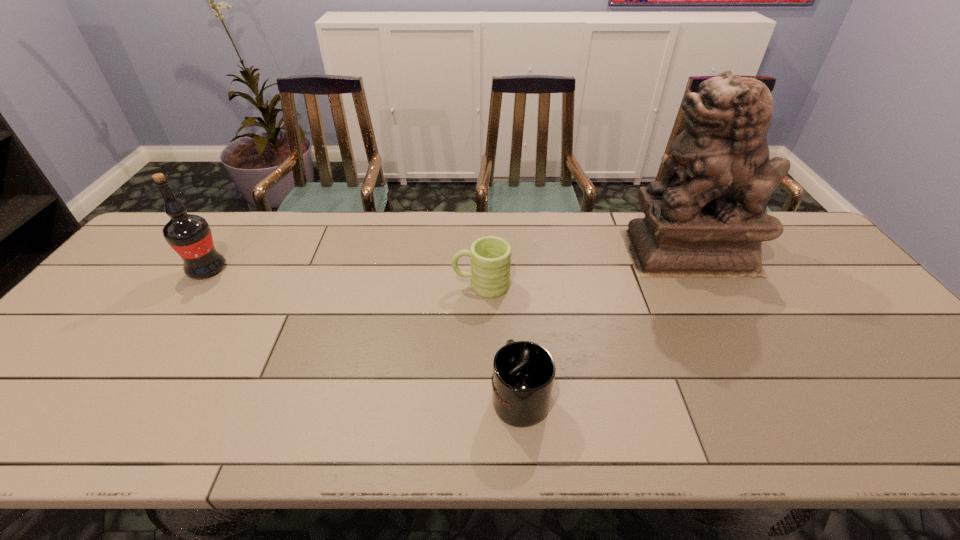
At what (x,y) coordinates should I click in order to perform the action: click on vacant space located on the side of the farther mug with the handle. Please return your answer as a coordinate pair (x, y). Looking at the image, I should click on pyautogui.click(x=349, y=285).

The image size is (960, 540). I want to click on vacant space located 0.250m on the side of the farther mug with the handle, so click(364, 285).

The image size is (960, 540). Identify the location of free spot located 0.310m on the side of the farther mug with the handle. (343, 285).

The height and width of the screenshot is (540, 960). I want to click on free region located with the handle on the side of the nearest object, so click(x=511, y=277).

The image size is (960, 540). Identify the location of free space located 0.140m with the handle on the side of the nearest object. (514, 321).

Locate an element on the screen. vacant space located 0.230m with the handle on the side of the nearest object is located at coordinates (512, 296).

Locate an element on the screen. This screenshot has width=960, height=540. object at the far edge is located at coordinates (707, 217).

Image resolution: width=960 pixels, height=540 pixels. Find the location of `object that is at the near edge`. object that is at the near edge is located at coordinates (523, 375).

Identify the location of free space at the far edge. (240, 214).

You are a GUI agent. You are given a task and a screenshot of the screen. Output one action in this format:
    pyautogui.click(x=<x>, y=<y>)
    Task: Click on the blank space at the left edge
    This screenshot has width=960, height=540.
    Given the screenshot: What is the action you would take?
    pyautogui.click(x=108, y=321)